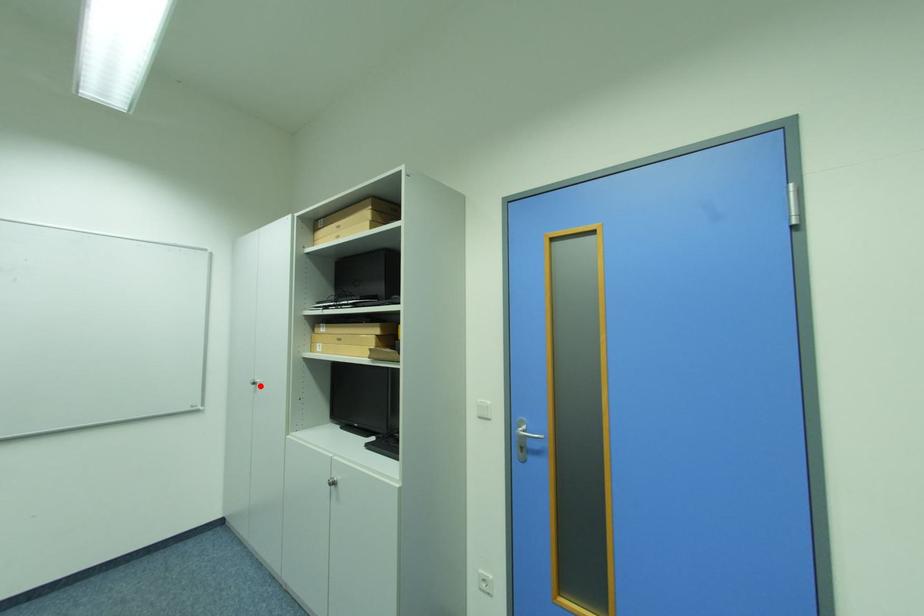
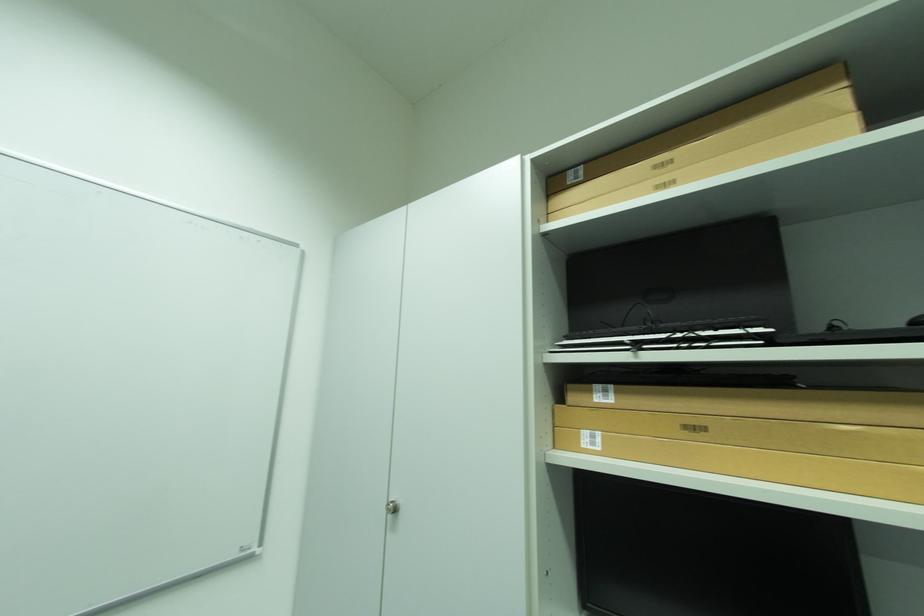
Find the pixel in the second image that matches the highlighted location in the first image.

(394, 512)